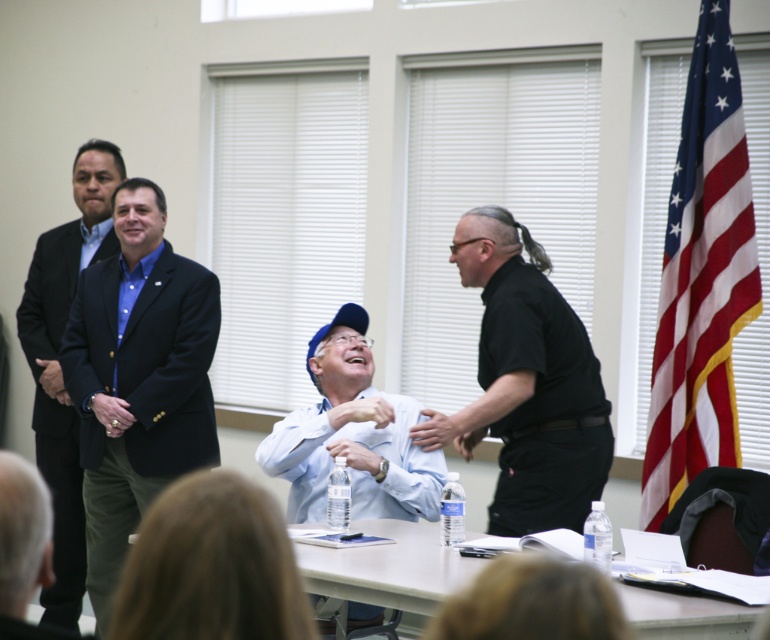
You are an event planner arranging seating for a meeting. You need to place a name tag for the person wearing the blue fabric cap at center and the matte black suit at left. Based on their positions in the image, which person is seated to the right of the other?

The blue fabric cap at center is positioned on the right side of the matte black suit at left, so the person wearing the blue fabric cap at center is seated to the right of the matte black suit at left.

You are a photographer setting up for a formal event. You need to position a camera so that both the matte black suit at left and the white plastic table at lower center are in frame. Given their relative heights, which object should you adjust the camera angle to focus on first to ensure both are visible?

The matte black suit at left is taller than the white plastic table at lower center, so you should adjust the camera angle to focus on the matte black suit at left first to ensure both are visible.